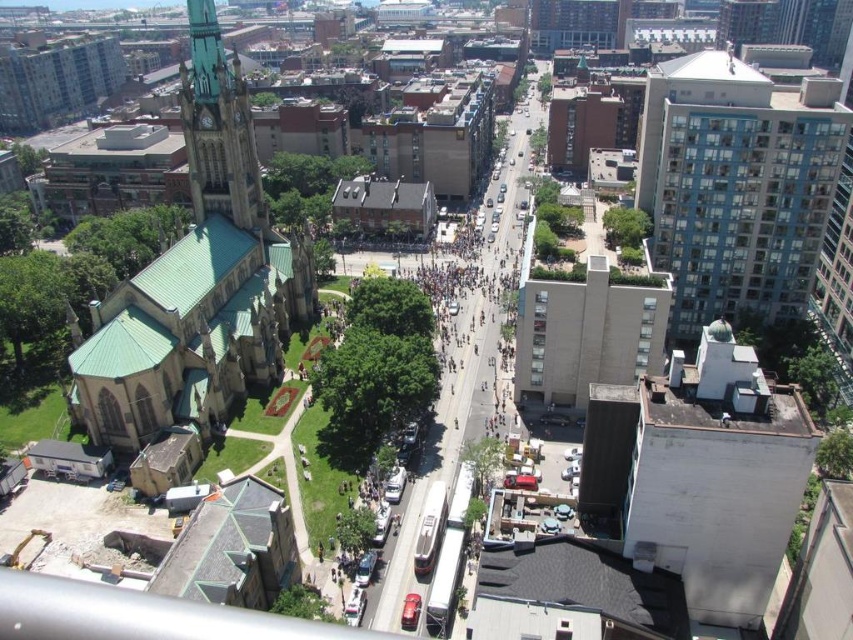
Can you confirm if green stone church at left is smaller than green copper tower at upper left?

Incorrect, green stone church at left is not smaller in size than green copper tower at upper left.

From the picture: Who is more forward, (265, 355) or (189, 38)?

Point (189, 38) is more forward.

Image resolution: width=853 pixels, height=640 pixels. Find the location of `green stone church at left`. green stone church at left is located at coordinates (196, 282).

Who is lower down, blue glass building at upper right or green copper tower at upper left?

blue glass building at upper right

Is point (796, 244) positioned after point (227, 186)?

No, it is in front of (227, 186).

Find the location of a particular element. blue glass building at upper right is located at coordinates (735, 186).

Image resolution: width=853 pixels, height=640 pixels. I want to click on blue glass building at upper right, so click(735, 186).

Looking at this image, which of these two, green stone church at left or blue glass building at upper right, stands taller?

green stone church at left is taller.

Is point (109, 417) closer to camera compared to point (814, 161)?

Yes, point (109, 417) is in front of point (814, 161).

I want to click on green stone church at left, so click(x=196, y=282).